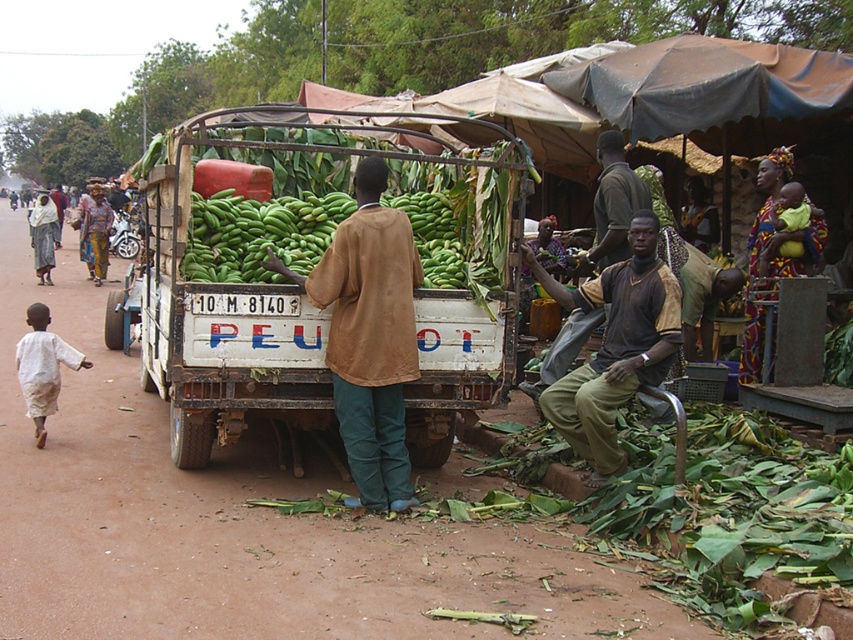
Which of these two, brown cotton shirt at center or green matte bananas at center, stands taller?

Standing taller between the two is brown cotton shirt at center.

Who is more distant from viewer, [560,413] or [236,280]?

The point [560,413] is more distant.

Does point (613, 454) lie behind point (274, 209)?

No, it is not.

I want to click on brown cotton shirt at center, so click(x=614, y=346).

Is point (436, 460) behind point (373, 237)?

Yes, it is behind point (373, 237).

Between green matte truck at center and brown matte jacket at center, which one appears on the right side from the viewer's perspective?

Positioned to the right is brown matte jacket at center.

Who is more distant from viewer, (260, 273) or (367, 172)?

The point (260, 273) is more distant.

At what (x,y) coordinates should I click in order to perform the action: click on green matte truck at center. Please return your answer as a coordinate pair (x, y). The image size is (853, 640). Looking at the image, I should click on (306, 273).

Is point (370, 188) farther from viewer compared to point (207, 248)?

No, (370, 188) is in front of (207, 248).

Does brown matte jacket at center appear on the left side of green matte bananas at center?

Incorrect, brown matte jacket at center is not on the left side of green matte bananas at center.

What are the coordinates of `brown matte jacket at center` in the screenshot? It's located at (369, 336).

Find the location of a particular element. brown matte jacket at center is located at coordinates pyautogui.click(x=369, y=336).